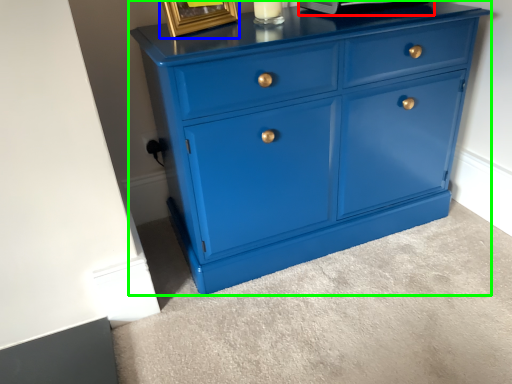
Question: Considering the real-world distances, which object is farthest from appliance (highlighted by a red box)? picture frame (highlighted by a blue box) or chest of drawers (highlighted by a green box)?

Choices:
 (A) picture frame
 (B) chest of drawers

Answer: (B)